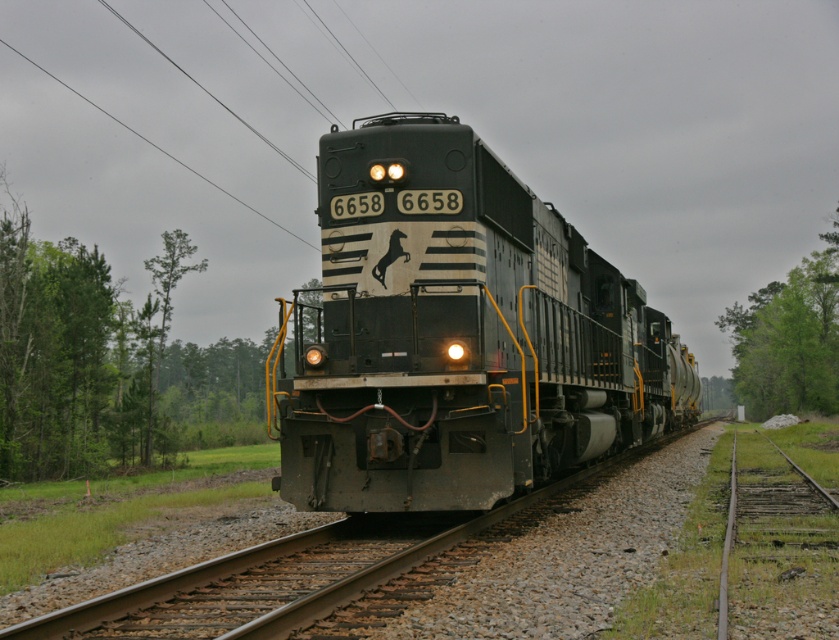
Question: Which point is closer to the camera?

Choices:
 (A) metallic locomotive at center
 (B) green leafy tree at right

Answer: (A)

Question: Is green leafy tree at left to the right of green leafy tree at right from the viewer's perspective?

Choices:
 (A) yes
 (B) no

Answer: (B)

Question: Among these points, which one is nearest to the camera?

Choices:
 (A) (35, 248)
 (B) (358, 493)

Answer: (B)

Question: Does metallic locomotive at center have a greater width compared to green leafy tree at right?

Choices:
 (A) no
 (B) yes

Answer: (A)

Question: Which of these objects is positioned farthest from the green leafy tree at left?

Choices:
 (A) green leafy tree at right
 (B) metallic locomotive at center

Answer: (A)

Question: Is metallic locomotive at center to the right of green leafy tree at left from the viewer's perspective?

Choices:
 (A) no
 (B) yes

Answer: (B)